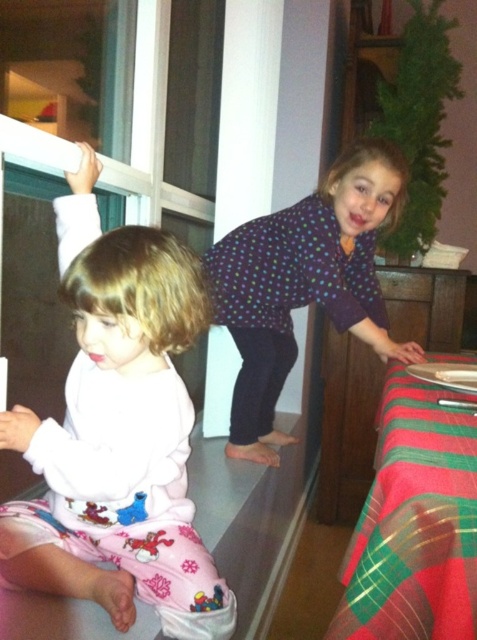
Who is higher up, polka dot shirt at upper right or white plastic screen door at left?

polka dot shirt at upper right is higher up.

Does polka dot shirt at upper right appear under white plastic screen door at left?

No, polka dot shirt at upper right is not below white plastic screen door at left.

What do you see at coordinates (304, 284) in the screenshot? I see `polka dot shirt at upper right` at bounding box center [304, 284].

Find the location of `polka dot shirt at upper right`. polka dot shirt at upper right is located at coordinates (304, 284).

Can you confirm if polka dot shirt at upper right is positioned to the left of red plaid tablecloth at lower right?

Correct, you'll find polka dot shirt at upper right to the left of red plaid tablecloth at lower right.

Between point (322, 236) and point (474, 515), which one is positioned behind?

The point (322, 236) is more distant.

Where is `polka dot shirt at upper right`? polka dot shirt at upper right is located at coordinates (304, 284).

Does white soft pajamas at left have a greater height compared to red plaid tablecloth at lower right?

Correct, white soft pajamas at left is much taller as red plaid tablecloth at lower right.

Is white soft pajamas at left to the left of red plaid tablecloth at lower right from the viewer's perspective?

Indeed, white soft pajamas at left is positioned on the left side of red plaid tablecloth at lower right.

Does point (138, 541) come behind point (372, 608)?

Yes, it is behind point (372, 608).

You are a GUI agent. You are given a task and a screenshot of the screen. Output one action in this format:
    pyautogui.click(x=<x>, y=<y>)
    Task: Click on the white soft pajamas at left
    The width and height of the screenshot is (477, 640).
    Given the screenshot: What is the action you would take?
    pyautogui.click(x=117, y=433)